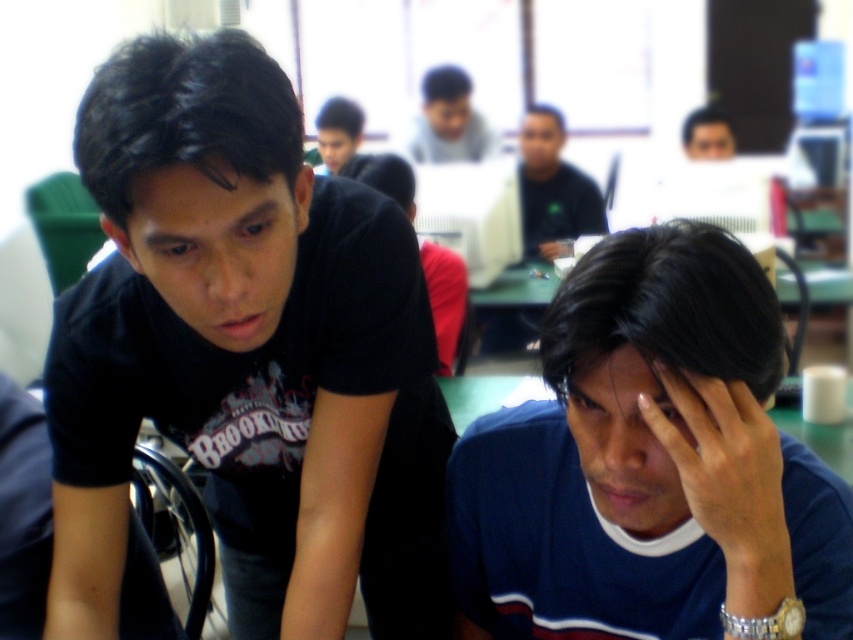
You are a photographer standing in the classroom scene. You want to take a photo of the dark blue sweater at lower right and the smooth skin face at center. Which object should you focus on first to ensure both are in the frame?

The dark blue sweater at lower right is positioned under the smooth skin face at center, so you should focus on the smooth skin face at center first to ensure both are in the frame.

You are standing in the classroom and need to locate the dark blue fabric shirt at center. What are the coordinates of its position?

The dark blue fabric shirt at center is located at coordinates point (648, 461).

You are a photographer standing in the classroom and want to take a photo of both the dark blue sweater at lower right and the smooth skin face at center. Which object should you focus on first to ensure both are in sharp focus?

The dark blue sweater at lower right is closer to the viewer than the smooth skin face at center. To ensure both are in sharp focus, you should focus on the dark blue sweater at lower right first, as it is closer, and the depth of field will extend to the smooth skin face at center.